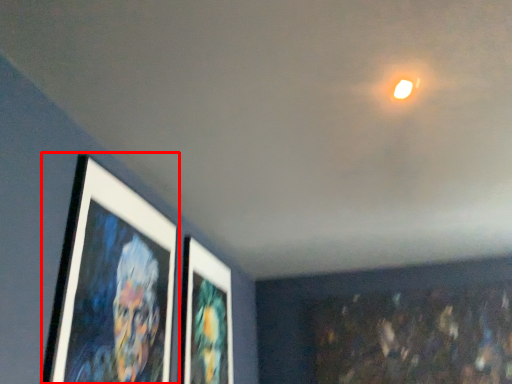
Question: In this image, where is picture frame (annotated by the red box) located relative to picture frame?

Choices:
 (A) left
 (B) right

Answer: (A)